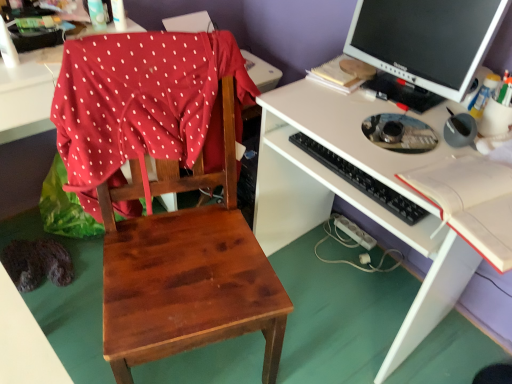
The width and height of the screenshot is (512, 384). Find the location of `vacant space to the left of matte black monitor at upper right`. vacant space to the left of matte black monitor at upper right is located at coordinates (330, 104).